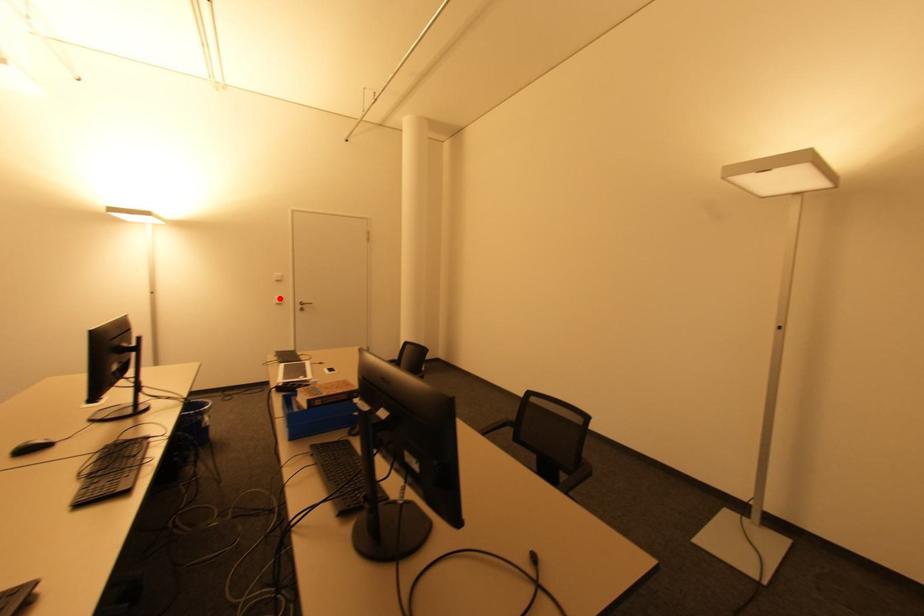
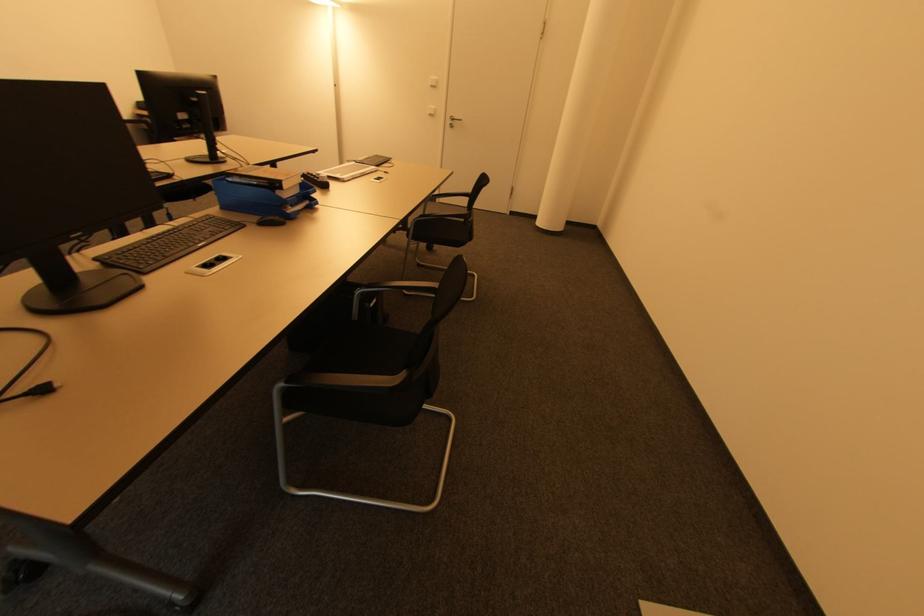
Where in the second image is the point corresponding to the highlighted location from the first image?

(433, 108)